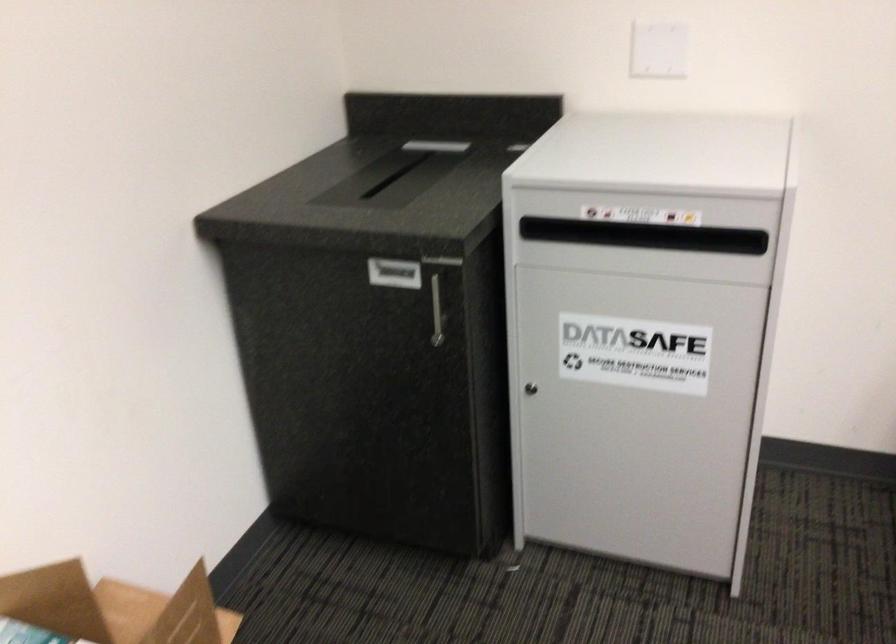
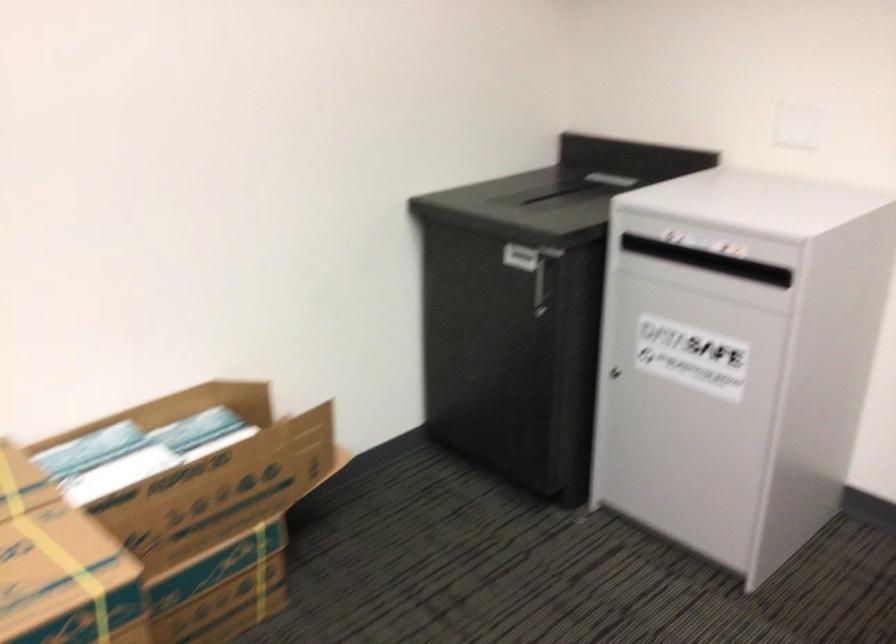
The point at (625, 228) is marked in the first image. Where is the corresponding point in the second image?

(748, 269)